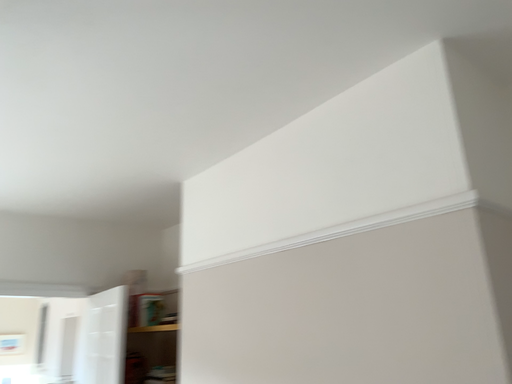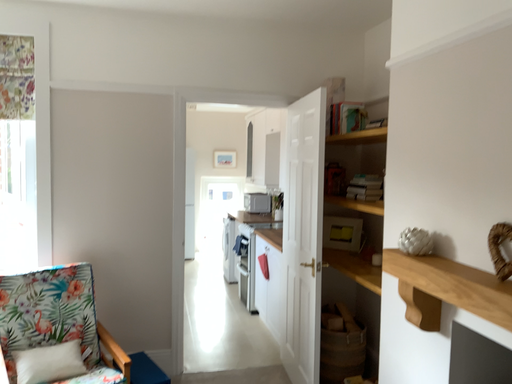
Question: Which way did the camera rotate in the video?

Choices:
 (A) rotated upward
 (B) rotated downward

Answer: (B)